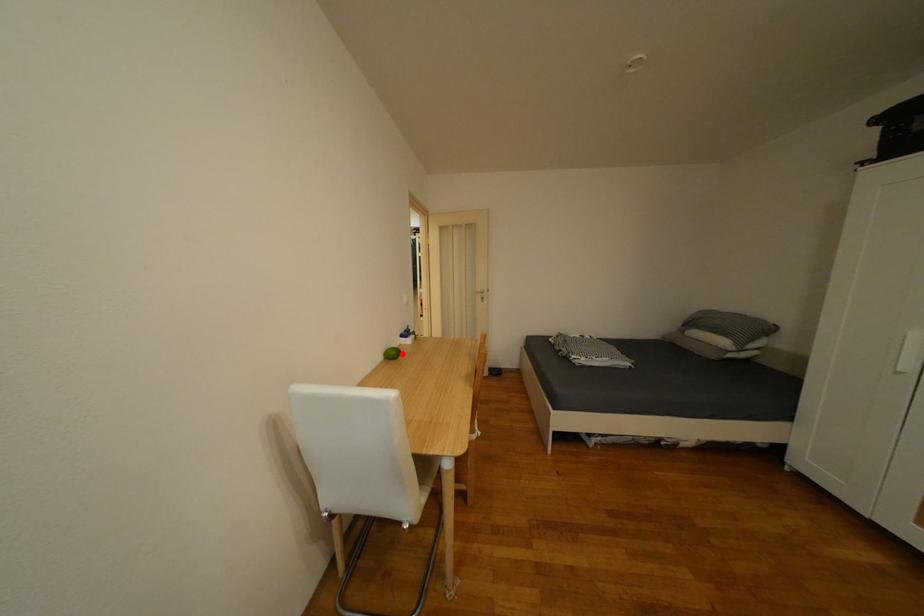
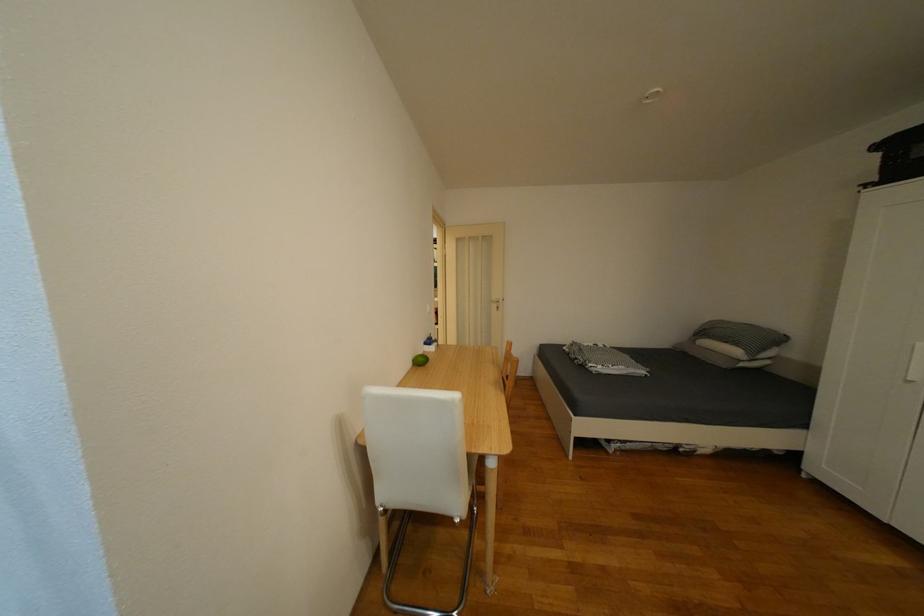
The point at the highlighted location is marked in the first image. Where is the corresponding point in the second image?

(431, 361)